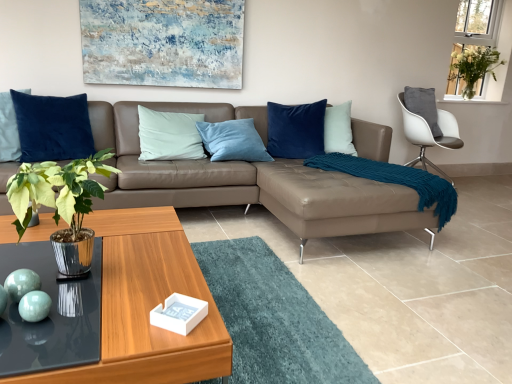
This screenshot has height=384, width=512. I want to click on vacant area that is in front of teal glossy spheres at lower left, the first teal in the left-to-right sequence, so click(x=23, y=334).